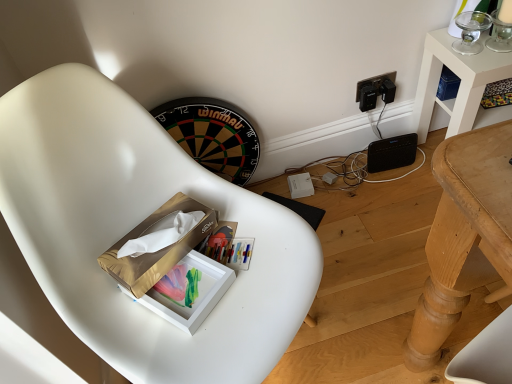
Question: Can gold cardboard box at center be found inside matte gold tissue box at center?

Choices:
 (A) no
 (B) yes

Answer: (A)

Question: From the image's perspective, is matte gold tissue box at center beneath gold cardboard box at center?

Choices:
 (A) yes
 (B) no

Answer: (A)

Question: Considering the relative sizes of matte gold tissue box at center and gold cardboard box at center in the image provided, is matte gold tissue box at center shorter than gold cardboard box at center?

Choices:
 (A) yes
 (B) no

Answer: (A)

Question: Is matte gold tissue box at center facing towards gold cardboard box at center?

Choices:
 (A) yes
 (B) no

Answer: (B)

Question: Can you confirm if matte gold tissue box at center is positioned to the right of gold cardboard box at center?

Choices:
 (A) yes
 (B) no

Answer: (A)

Question: Would you say matte gold tissue box at center is a long distance from gold cardboard box at center?

Choices:
 (A) yes
 (B) no

Answer: (B)

Question: Is matte gold tissue box at center next to white matte chair at center?

Choices:
 (A) yes
 (B) no

Answer: (B)

Question: From the image's perspective, is matte gold tissue box at center located above white matte chair at center?

Choices:
 (A) no
 (B) yes

Answer: (A)

Question: From a real-world perspective, is matte gold tissue box at center on top of white matte chair at center?

Choices:
 (A) yes
 (B) no

Answer: (A)

Question: Does matte gold tissue box at center have a greater width compared to white matte chair at center?

Choices:
 (A) no
 (B) yes

Answer: (A)

Question: Is matte gold tissue box at center to the left of white matte chair at center from the viewer's perspective?

Choices:
 (A) no
 (B) yes

Answer: (B)

Question: Is matte gold tissue box at center taller than white matte chair at center?

Choices:
 (A) no
 (B) yes

Answer: (A)

Question: Is gold cardboard box at center at the right side of white matte chair at center?

Choices:
 (A) yes
 (B) no

Answer: (B)